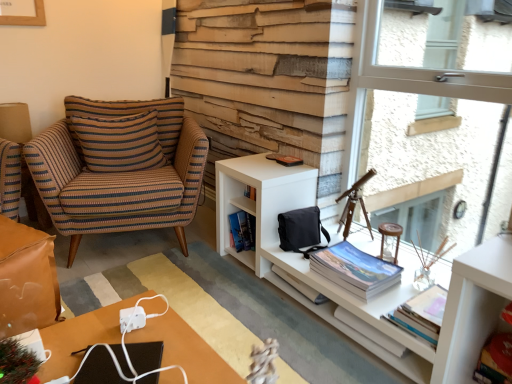
What do you see at coordinates (355, 270) in the screenshot? Image resolution: width=512 pixels, height=384 pixels. I see `matte paper book at lower right, the second book when ordered from left to right` at bounding box center [355, 270].

The image size is (512, 384). Describe the element at coordinates (27, 279) in the screenshot. I see `brown leather table at lower left` at that location.

The width and height of the screenshot is (512, 384). Identify the location of brown striped fabric armchair at left. (119, 174).

Image resolution: width=512 pixels, height=384 pixels. What do you see at coordinates (186, 350) in the screenshot?
I see `matte black desk at lower left` at bounding box center [186, 350].

In order to face hardcover book at center, the 1th book positioned from the left, should I rotate leftwards or rightwards?

Rotate right and turn 6.584 degrees.

Measure the distance between hardcover book at center, which appears as the 4th book when viewed from the right, and camera.

A distance of 5.67 feet exists between hardcover book at center, which appears as the 4th book when viewed from the right, and camera.

Identify the location of matte paper book at lower right, the 3th book in the right-to-left sequence. The height and width of the screenshot is (384, 512). (355, 270).

Is striped fabric pillow at upper left facing towards matte black desk at lower left?

Yes, striped fabric pillow at upper left is turned towards matte black desk at lower left.

I want to click on pillow behind the matte black desk at lower left, so click(118, 142).

In the image, is striped fabric pillow at upper left positioned in front of or behind matte black desk at lower left?

striped fabric pillow at upper left is behind matte black desk at lower left.

Choose the correct answer: Is striped fabric pillow at upper left inside matte black desk at lower left or outside it?

striped fabric pillow at upper left is spatially situated outside matte black desk at lower left.

Is hardcover book at lower right, which is counted as the 4th book, starting from the left, facing away from matte black desk at lower left?

No, hardcover book at lower right, which is counted as the 4th book, starting from the left,'s orientation is not away from matte black desk at lower left.

Does point (510, 367) come in front of point (121, 307)?

No, (510, 367) is behind (121, 307).

Does hardcover book at lower right, placed as the first book when sorted from right to left, appear on the right side of matte black desk at lower left?

Yes.

Which object is further away from the camera, hardcover book at lower right, placed as the first book when sorted from right to left, or matte black desk at lower left?

hardcover book at lower right, placed as the first book when sorted from right to left, is further from the camera.

This screenshot has width=512, height=384. Find the location of `pillow on the left side of hardcover book at lower right, which is counted as the 4th book, starting from the left`. pillow on the left side of hardcover book at lower right, which is counted as the 4th book, starting from the left is located at coordinates (118, 142).

Is striped fabric pillow at upper left with hardcover book at lower right, placed as the first book when sorted from right to left?

No, striped fabric pillow at upper left is not beside hardcover book at lower right, placed as the first book when sorted from right to left.

Does striped fabric pillow at upper left appear on the left side of hardcover book at lower right, placed as the first book when sorted from right to left?

Yes.

Which is nearer, (136, 120) or (496, 367)?

Clearly, point (136, 120) is more distant from the camera than point (496, 367).

Between striped fabric pillow at upper left and transparent glass window at upper right, which one appears on the right side from the viewer's perspective?

transparent glass window at upper right is more to the right.

What's the angular difference between striped fabric pillow at upper left and transparent glass window at upper right's facing directions?

They differ by 77.8 degrees in their facing directions.

From the image's perspective, who appears lower, striped fabric pillow at upper left or transparent glass window at upper right?

transparent glass window at upper right, from the image's perspective.

Is striped fabric pillow at upper left touching transparent glass window at upper right?

striped fabric pillow at upper left is not next to transparent glass window at upper right, and they're not touching.

Identify the location of chair in front of the striped fabric pillow at upper left. The width and height of the screenshot is (512, 384). (119, 174).

From a real-world perspective, between brown striped fabric armchair at left and striped fabric pillow at upper left, who is vertically higher?

striped fabric pillow at upper left.

Is transparent glass window at upper right shorter than hardcover book at lower right, placed as the first book when sorted from right to left?

In fact, transparent glass window at upper right may be taller than hardcover book at lower right, placed as the first book when sorted from right to left.

Based on the photo, are transparent glass window at upper right and hardcover book at lower right, placed as the first book when sorted from right to left, located far from each other?

Yes, transparent glass window at upper right and hardcover book at lower right, placed as the first book when sorted from right to left, are located far from each other.

This screenshot has height=384, width=512. What are the coordinates of `window behind the hardcover book at lower right, placed as the first book when sorted from right to left` in the screenshot? It's located at (426, 113).

How different are the orientations of white matte cabinet at right and green matte christmas tree at lower left in degrees?

The angular difference between white matte cabinet at right and green matte christmas tree at lower left is 85.2 degrees.

You are a GUI agent. You are given a task and a screenshot of the screen. Output one action in this format:
    pyautogui.click(x=<x>, y=<y>)
    Task: Click on the cabinetry on the right of green matte christmas tree at lower left
    
    Given the screenshot: What is the action you would take?
    point(392,287)

Is white matte cabinet at right at the left side of green matte christmas tree at lower left?

In fact, white matte cabinet at right is to the right of green matte christmas tree at lower left.

Is white matte cabinet at right aimed at green matte christmas tree at lower left?

Yes, white matte cabinet at right is turned towards green matte christmas tree at lower left.

Image resolution: width=512 pixels, height=384 pixels. Identify the location of pillow above the matte black desk at lower left (from the image's perspective). (118, 142).

Locate an element on the screen. desk above the hardcover book at lower right, which is counted as the 4th book, starting from the left (from a real-world perspective) is located at coordinates (186, 350).

Which object lies nearer to the anchor point hardcover book at center, the 1th book positioned from the left, green matte christmas tree at lower left or brown striped fabric armchair at left?

The object closer to hardcover book at center, the 1th book positioned from the left, is brown striped fabric armchair at left.

Based on their spatial positions, is hardcover book at center, which appears as the 4th book when viewed from the right, or matte black desk at lower left closer to matte paper book at lower right, the second book when ordered from left to right?

hardcover book at center, which appears as the 4th book when viewed from the right, is closer to matte paper book at lower right, the second book when ordered from left to right.

Looking at the image, which one is located closer to brown striped fabric armchair at left, white matte cabinet at right or transparent glass window at upper right?

white matte cabinet at right is closer to brown striped fabric armchair at left.

Based on their spatial positions, is white paper book at center, which appears as the 2th book when viewed from the right, or transparent glass window at upper right closer to matte paper book at lower right, the second book when ordered from left to right?

white paper book at center, which appears as the 2th book when viewed from the right, is closer to matte paper book at lower right, the second book when ordered from left to right.

From the picture: Looking at the image, which one is located closer to white matte cabinet at right, brown leather table at lower left or striped fabric pillow at upper left?

striped fabric pillow at upper left lies closer to white matte cabinet at right than the other object.

Based on their spatial positions, is matte paper book at lower right, the second book when ordered from left to right, or white paper book at center, which appears as the 2th book when viewed from the right, further from brown leather table at lower left?

white paper book at center, which appears as the 2th book when viewed from the right, lies further to brown leather table at lower left than the other object.

Based on their spatial positions, is striped fabric pillow at upper left or green matte christmas tree at lower left closer to white matte cabinet at right?

Based on the image, striped fabric pillow at upper left appears to be nearer to white matte cabinet at right.

From the image, which object appears to be nearer to green matte christmas tree at lower left, hardcover book at lower right, placed as the first book when sorted from right to left, or matte black desk at lower left?

matte black desk at lower left is positioned closer to the anchor green matte christmas tree at lower left.

You are a GUI agent. You are given a task and a screenshot of the screen. Output one action in this format:
    pyautogui.click(x=<x>, y=<y>)
    Task: Click on the cabinetry between matte black desk at lower left and matte paper book at lower right, the 3th book in the right-to-left sequence
    Image resolution: width=512 pixels, height=384 pixels.
    Given the screenshot: What is the action you would take?
    pyautogui.click(x=392, y=287)

The height and width of the screenshot is (384, 512). Identify the location of cabinetry between brown leather table at lower left and transparent glass window at upper right in the horizontal direction. (392, 287).

Identify the location of christmas decoration between striped fabric pillow at upper left and hardcover book at lower right, which is counted as the 4th book, starting from the left. (17, 363).

Locate an element on the screen. This screenshot has width=512, height=384. cabinetry located between brown leather table at lower left and white paper book at center, which appears as the 2th book when viewed from the right, in the left-right direction is located at coordinates (392, 287).